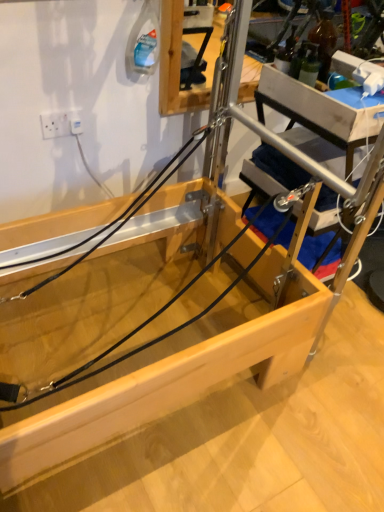
Question: From the image's perspective, is white plastic electric outlet at upper left below transparent plastic at center?

Choices:
 (A) yes
 (B) no

Answer: (B)

Question: Does white plastic electric outlet at upper left have a smaller size compared to transparent plastic at center?

Choices:
 (A) yes
 (B) no

Answer: (A)

Question: Is white plastic electric outlet at upper left oriented away from transparent plastic at center?

Choices:
 (A) yes
 (B) no

Answer: (B)

Question: Can you confirm if white plastic electric outlet at upper left is positioned to the right of transparent plastic at center?

Choices:
 (A) no
 (B) yes

Answer: (A)

Question: Considering the relative sizes of white plastic electric outlet at upper left and transparent plastic at center in the image provided, is white plastic electric outlet at upper left thinner than transparent plastic at center?

Choices:
 (A) yes
 (B) no

Answer: (A)

Question: Is white plastic electric outlet at upper left taller than transparent plastic at center?

Choices:
 (A) yes
 (B) no

Answer: (A)

Question: Is transparent plastic at center turned away from white plastic electric outlet at upper left?

Choices:
 (A) yes
 (B) no

Answer: (B)

Question: Does transparent plastic at center appear on the left side of white plastic electric outlet at upper left?

Choices:
 (A) no
 (B) yes

Answer: (A)

Question: Is transparent plastic at center further to the viewer compared to white plastic electric outlet at upper left?

Choices:
 (A) no
 (B) yes

Answer: (A)

Question: Considering the relative sizes of transparent plastic at center and white plastic electric outlet at upper left in the image provided, is transparent plastic at center thinner than white plastic electric outlet at upper left?

Choices:
 (A) no
 (B) yes

Answer: (A)

Question: Does transparent plastic at center appear on the right side of white plastic electric outlet at upper left?

Choices:
 (A) yes
 (B) no

Answer: (A)

Question: From the image's perspective, is transparent plastic at center below white plastic electric outlet at upper left?

Choices:
 (A) yes
 (B) no

Answer: (A)

Question: From the image's perspective, relative to white plastic electric outlet at upper left, is transparent plastic at center above or below?

Choices:
 (A) above
 (B) below

Answer: (B)